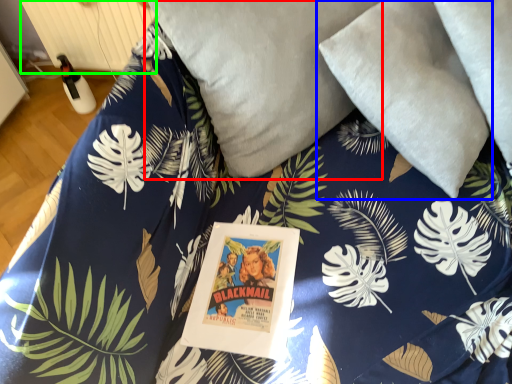
Question: Considering the real-world distances, which object is closest to pillow (highlighted by a red box)? pillow (highlighted by a blue box) or radiator (highlighted by a green box).

Choices:
 (A) pillow
 (B) radiator

Answer: (A)